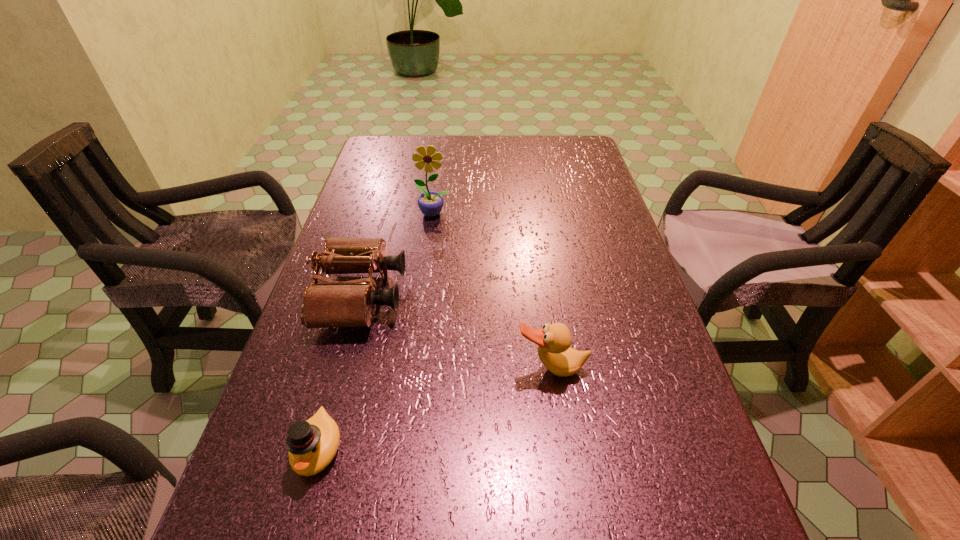
Locate an element on the screen. This screenshot has height=540, width=960. the farthest object is located at coordinates (430, 203).

Locate an element on the screen. This screenshot has width=960, height=540. sunflower is located at coordinates (430, 203).

At what (x,y) coordinates should I click in order to perform the action: click on binoculars. Please return your answer as a coordinate pair (x, y). Looking at the image, I should click on [x=350, y=303].

At what (x,y) coordinates should I click in order to perform the action: click on the rightmost object. Please return your answer as a coordinate pair (x, y). The height and width of the screenshot is (540, 960). Looking at the image, I should click on (553, 340).

Where is `the taller duck`? The width and height of the screenshot is (960, 540). the taller duck is located at coordinates (553, 340).

The width and height of the screenshot is (960, 540). In order to click on the shorter duck in this screenshot , I will do `click(312, 444)`.

The height and width of the screenshot is (540, 960). I want to click on the shortest object, so click(312, 444).

Where is `blank area located 0.360m on the front-facing side of the farthest object`? The width and height of the screenshot is (960, 540). blank area located 0.360m on the front-facing side of the farthest object is located at coordinates (420, 319).

You are a GUI agent. You are given a task and a screenshot of the screen. Output one action in this format:
    pyautogui.click(x=<x>, y=<y>)
    Task: Click on the vacant region located 0.180m through the eyepieces of the third nearest object
    The image size is (960, 540).
    Given the screenshot: What is the action you would take?
    pyautogui.click(x=481, y=296)

Find the location of `vacant space located on the beak of the third farthest object`. vacant space located on the beak of the third farthest object is located at coordinates pyautogui.click(x=566, y=471).